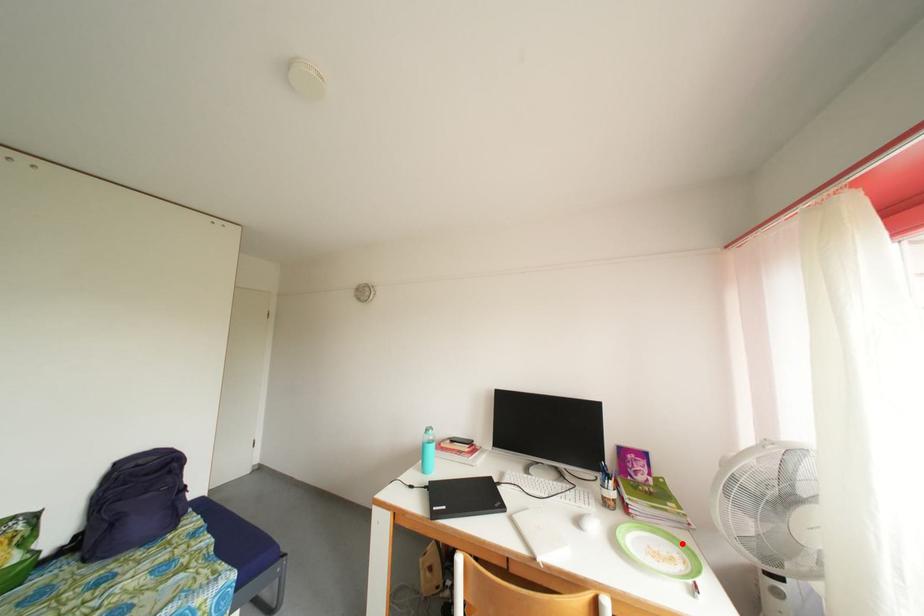
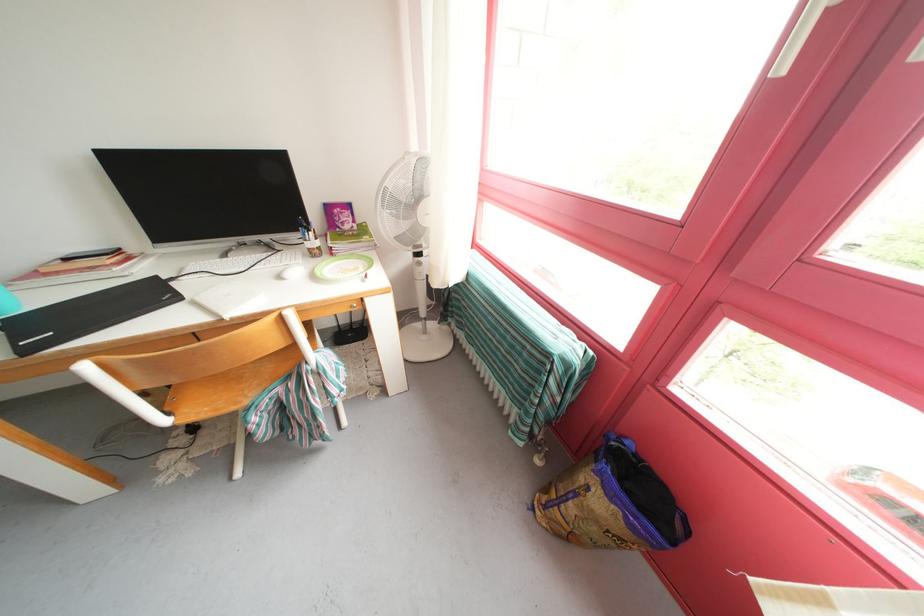
In the second image, find the point that corresponds to the highlighted location in the first image.

(369, 262)